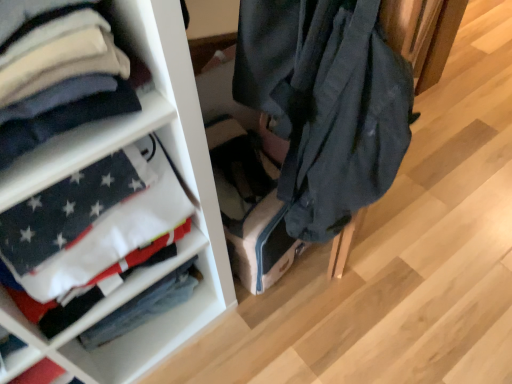
This screenshot has height=384, width=512. Identify the location of vacant space underneath white cotton flag at left (from a real-world perspective). (158, 314).